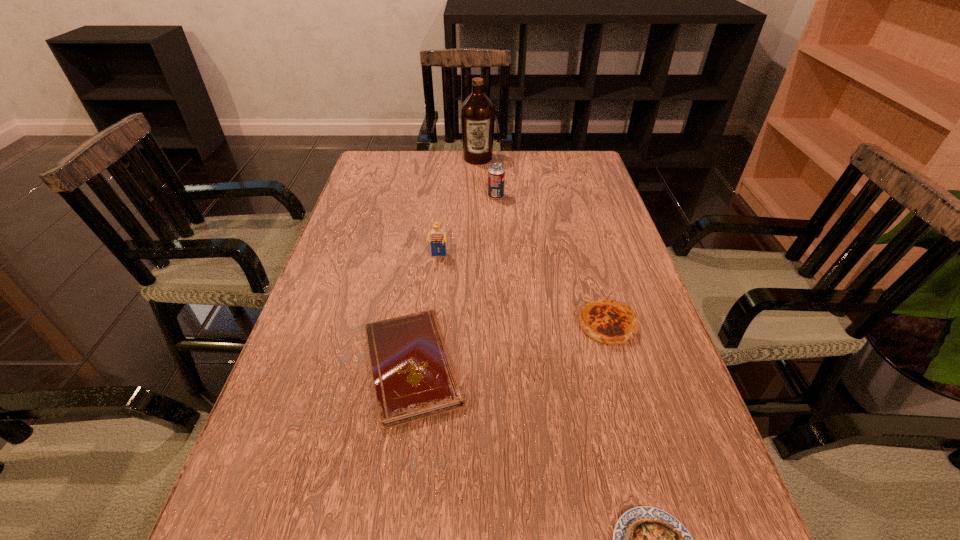
You are a GUI agent. You are given a task and a screenshot of the screen. Output one action in this format:
    pyautogui.click(x=<x>, y=<y>)
    Task: Click on the tallest object
    The width and height of the screenshot is (960, 540).
    Given the screenshot: What is the action you would take?
    pyautogui.click(x=477, y=112)

Find the location of a particular element. The height and width of the screenshot is (540, 960). olive oil is located at coordinates (477, 112).

Locate an element on the screen. The image size is (960, 540). the second farthest object is located at coordinates (496, 173).

Locate an element on the screen. The image size is (960, 540). Lego is located at coordinates (438, 237).

Image resolution: width=960 pixels, height=540 pixels. What are the coordinates of `the taller quiche` in the screenshot? It's located at [x=607, y=321].

The height and width of the screenshot is (540, 960). I want to click on the fourth tallest object, so click(607, 321).

Find the location of a particular element. This screenshot has height=540, width=960. notebook is located at coordinates (413, 375).

The image size is (960, 540). What are the coordinates of `free space located 0.070m on the label of the tallest object` in the screenshot? It's located at (478, 177).

Find the location of a particular element. The width and height of the screenshot is (960, 540). vacant space located 0.210m on the back of the second farthest object is located at coordinates (494, 159).

The height and width of the screenshot is (540, 960). Find the location of `free region located on the face of the Lego`. free region located on the face of the Lego is located at coordinates (425, 374).